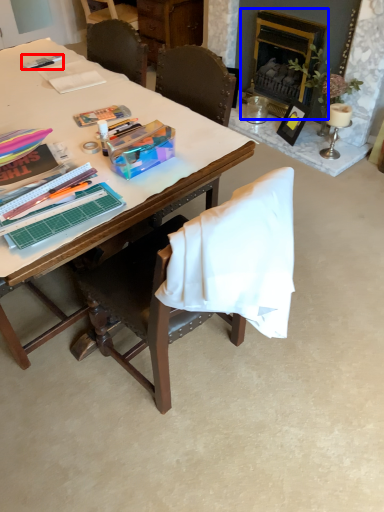
Question: Which point is closer to the camera, pen (highlighted by a red box) or fireplace (highlighted by a blue box)?

Choices:
 (A) pen
 (B) fireplace

Answer: (A)